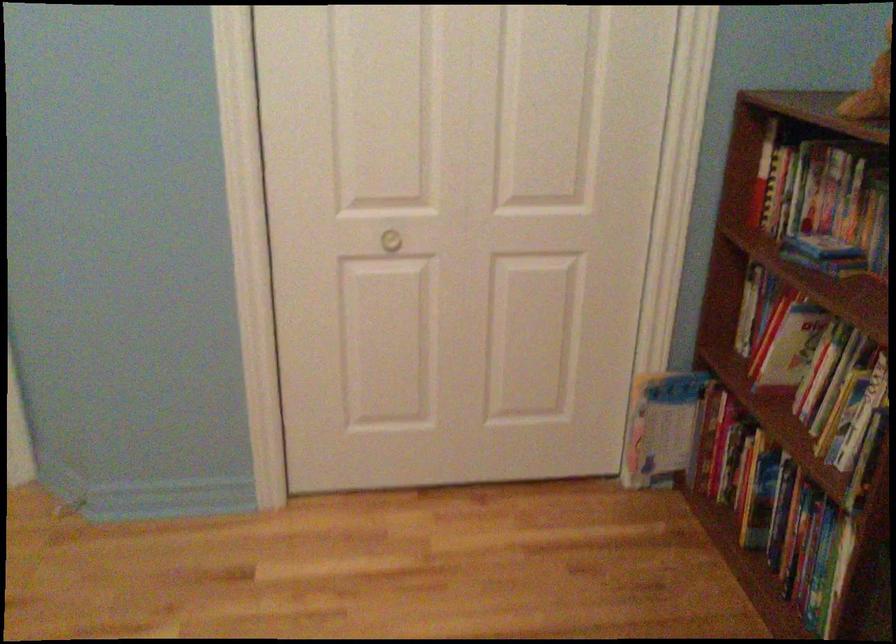
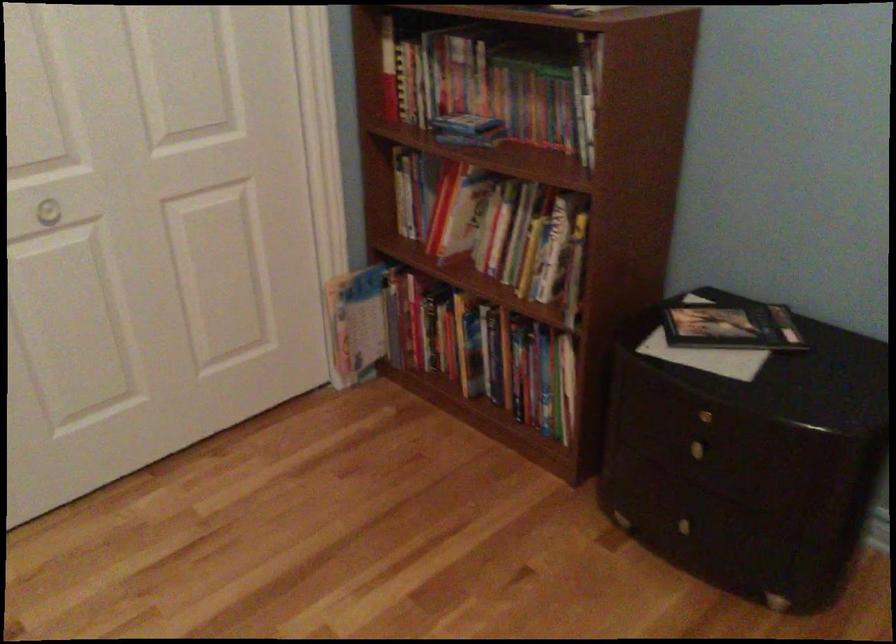
In the second image, find the point that corresponds to [728,462] in the first image.

(428, 335)